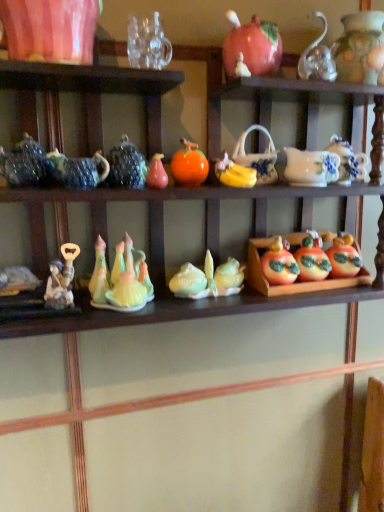
In order to click on matte ceramic apples at center right in this screenshot , I will do `click(316, 264)`.

How much space does transparent glass mug at upper center, which ranks as the 3th tableware in left-to-right order, occupy horizontally?

transparent glass mug at upper center, which ranks as the 3th tableware in left-to-right order, is 6.12 inches in width.

This screenshot has width=384, height=512. What do you see at coordinates (208, 279) in the screenshot?
I see `matte ceramic corn at center, the 2th toy from the back` at bounding box center [208, 279].

Image resolution: width=384 pixels, height=512 pixels. What do you see at coordinates (317, 58) in the screenshot?
I see `transparent glass teapot at upper right, the fifth tableware from the left` at bounding box center [317, 58].

Image resolution: width=384 pixels, height=512 pixels. Describe the element at coordinates (344, 257) in the screenshot. I see `matte ceramic pumpkin at center right, the second pumpkin when ordered from top to bottom` at that location.

Where is `yellow matte banana at center, the first fruit positioned from the front`? yellow matte banana at center, the first fruit positioned from the front is located at coordinates (234, 173).

From a real-world perspective, is matte pink vase at upper left, the 1th tableware when ordered from left to right, physically located above or below matte ceramic apples at center, arranged as the 2th toy when viewed from the top?

matte pink vase at upper left, the 1th tableware when ordered from left to right, is situated higher than matte ceramic apples at center, arranged as the 2th toy when viewed from the top, in the real world.

Between matte pink vase at upper left, which is the fifth tableware in right-to-left order, and matte ceramic apples at center, placed as the 3th toy when sorted from left to right, which one has less height?

Standing shorter between the two is matte ceramic apples at center, placed as the 3th toy when sorted from left to right.

What's the angular difference between matte pink vase at upper left, the 1th tableware when ordered from left to right, and matte ceramic apples at center, arranged as the 2th toy when viewed from the top,'s facing directions?

There is a 3.78-degree angle between the facing directions of matte pink vase at upper left, the 1th tableware when ordered from left to right, and matte ceramic apples at center, arranged as the 2th toy when viewed from the top.

Is matte pink vase at upper left, the 1th tableware when ordered from left to right, bigger than matte ceramic apples at center, the first toy when ordered from right to left?

Yes, matte pink vase at upper left, the 1th tableware when ordered from left to right, is bigger than matte ceramic apples at center, the first toy when ordered from right to left.

Locate an element on the screen. food on the right side of matte ceramic pumpkin at upper center, marked as the 2th pumpkin in a right-to-left arrangement is located at coordinates (316, 264).

Is matte ceramic pumpkin at upper center, the first pumpkin in the left-to-right sequence, oriented away from matte ceramic apples at center right?

No, matte ceramic apples at center right is not at the back of matte ceramic pumpkin at upper center, the first pumpkin in the left-to-right sequence.

Which object is further away from the camera taking this photo, matte ceramic pumpkin at upper center, placed as the second pumpkin when sorted from bottom to top, or matte ceramic apples at center right?

matte ceramic apples at center right is more distant.

From the image's perspective, does matte ceramic pumpkin at upper center, which ranks as the 1th pumpkin in top-to-bottom order, appear lower than matte ceramic apples at center right?

No, from the image's perspective, matte ceramic pumpkin at upper center, which ranks as the 1th pumpkin in top-to-bottom order, is not beneath matte ceramic apples at center right.

Is matte ceramic corn at center, positioned as the second toy in front-to-back order, in contact with yellow matte banana at center, positioned as the 1th fruit in left-to-right order?

No, matte ceramic corn at center, positioned as the second toy in front-to-back order, is not making contact with yellow matte banana at center, positioned as the 1th fruit in left-to-right order.

Which is in front, point (198, 282) or point (240, 174)?

The point (240, 174) is closer.

From a real-world perspective, which is physically below, matte ceramic corn at center, positioned as the second toy in right-to-left order, or yellow matte banana at center, placed as the 2th fruit when sorted from right to left?

From a 3D spatial view, matte ceramic corn at center, positioned as the second toy in right-to-left order, is below.

Is matte ceramic apples at center right shorter than matte ceramic corn at center, which ranks as the 1th toy in bottom-to-top order?

No, matte ceramic apples at center right is not shorter than matte ceramic corn at center, which ranks as the 1th toy in bottom-to-top order.

Is matte ceramic apples at center right oriented towards matte ceramic corn at center, which is the 2th toy in left-to-right order?

No, matte ceramic apples at center right is not aimed at matte ceramic corn at center, which is the 2th toy in left-to-right order.

Is matte ceramic apples at center right next to matte ceramic corn at center, positioned as the second toy in right-to-left order, and touching it?

No, matte ceramic apples at center right is not beside matte ceramic corn at center, positioned as the second toy in right-to-left order.

From a real-world perspective, is matte ceramic apples at center right physically located above or below matte ceramic corn at center, positioned as the second toy in front-to-back order?

matte ceramic apples at center right is above matte ceramic corn at center, positioned as the second toy in front-to-back order.

Consider the image. Is yellow matte banana at center, which is the 2th fruit in back-to-front order, wider or thinner than transparent glass teapot at upper right, the fifth tableware from the left?

Considering their sizes, yellow matte banana at center, which is the 2th fruit in back-to-front order, looks slimmer than transparent glass teapot at upper right, the fifth tableware from the left.

Between yellow matte banana at center, the first fruit positioned from the front, and transparent glass teapot at upper right, acting as the first tableware starting from the right, which one has smaller size?

yellow matte banana at center, the first fruit positioned from the front.

Considering the relative positions of yellow matte banana at center, placed as the 2th fruit when sorted from right to left, and transparent glass teapot at upper right, acting as the first tableware starting from the right, in the image provided, is yellow matte banana at center, placed as the 2th fruit when sorted from right to left, to the right of transparent glass teapot at upper right, acting as the first tableware starting from the right, from the viewer's perspective?

Incorrect, yellow matte banana at center, placed as the 2th fruit when sorted from right to left, is not on the right side of transparent glass teapot at upper right, acting as the first tableware starting from the right.

How much distance is there between yellow matte banana at center, acting as the 2th fruit starting from the bottom, and transparent glass teapot at upper right, the fifth tableware from the left?

The distance of yellow matte banana at center, acting as the 2th fruit starting from the bottom, from transparent glass teapot at upper right, the fifth tableware from the left, is 10.33 inches.

From the image's perspective, which is above, white porcelain vase at center, which appears as the 4th tableware when viewed from the left, or transparent glass teapot at upper right, the fifth tableware from the left?

transparent glass teapot at upper right, the fifth tableware from the left, appears higher in the image.

From the picture: In the image, is white porcelain vase at center, which ranks as the 2th tableware in right-to-left order, positioned in front of or behind transparent glass teapot at upper right, the fifth tableware from the left?

Visually, white porcelain vase at center, which ranks as the 2th tableware in right-to-left order, is located behind transparent glass teapot at upper right, the fifth tableware from the left.

Is the surface of white porcelain vase at center, which appears as the 4th tableware when viewed from the left, in direct contact with transparent glass teapot at upper right, the fifth tableware from the left?

No, white porcelain vase at center, which appears as the 4th tableware when viewed from the left, is not beside transparent glass teapot at upper right, the fifth tableware from the left.

Which is more to the right, white porcelain vase at center, which ranks as the 2th tableware in right-to-left order, or transparent glass teapot at upper right, the fifth tableware from the left?

Positioned to the right is transparent glass teapot at upper right, the fifth tableware from the left.

Is black glossy teapot at upper center, arranged as the second tableware when viewed from the left, not close to matte ceramic apples at center right?

Actually, black glossy teapot at upper center, arranged as the second tableware when viewed from the left, and matte ceramic apples at center right are a little close together.

From the image's perspective, which is below, black glossy teapot at upper center, arranged as the second tableware when viewed from the left, or matte ceramic apples at center right?

matte ceramic apples at center right, from the image's perspective.

At what (x,y) coordinates should I click in order to perform the action: click on the 5th tableware in front of the matte ceramic apples at center, the 1th toy positioned from the back, starting your count from the anchor. Please return your answer as a coordinate pair (x, y). Looking at the image, I should click on (50, 29).

I want to click on food below the matte ceramic pumpkin at upper center, placed as the second pumpkin when sorted from bottom to top (from the image's perspective), so click(316, 264).

Estimate the real-world distances between objects in this image. Which object is closer to transparent glass mug at upper center, which ranks as the 3th tableware in left-to-right order, matte ceramic corn at center, the 2th toy from the back, or matte ceramic apples at center right?

matte ceramic corn at center, the 2th toy from the back, is positioned closer to the anchor transparent glass mug at upper center, which ranks as the 3th tableware in left-to-right order.

Estimate the real-world distances between objects in this image. Which object is closer to pear-shaped ceramic at center, the 1th toy when ordered from top to bottom, yellow matte banana at center, acting as the 2th fruit starting from the bottom, or matte ceramic pumpkin at center right, which is counted as the first pumpkin, starting from the right?

yellow matte banana at center, acting as the 2th fruit starting from the bottom, is positioned closer to the anchor pear-shaped ceramic at center, the 1th toy when ordered from top to bottom.

From the image, which object appears to be nearer to matte ceramic pumpkin at center right, which is the first pumpkin in back-to-front order, pear-shaped ceramic at center, the 1th toy when ordered from top to bottom, or matte ceramic pumpkin at upper center, the first pumpkin in the left-to-right sequence?

matte ceramic pumpkin at upper center, the first pumpkin in the left-to-right sequence, is closer to matte ceramic pumpkin at center right, which is the first pumpkin in back-to-front order.

Which object lies nearer to the anchor point yellow matte banana at center, the first fruit positioned from the front, matte ceramic apples at center, the 3th toy viewed from the front, or transparent glass mug at upper center, the 3th tableware viewed from the right?

matte ceramic apples at center, the 3th toy viewed from the front.

In the scene shown: From the image, which object appears to be farther from transparent glass mug at upper center, the 3th tableware viewed from the right, matte ceramic corn at center, the 2th toy from the back, or white porcelain vase at center, which appears as the 4th tableware when viewed from the left?

The object further to transparent glass mug at upper center, the 3th tableware viewed from the right, is matte ceramic corn at center, the 2th toy from the back.

Considering their positions, is shiny ceramic apple at center right, marked as the first fruit in a back-to-front arrangement, positioned closer to matte ceramic apples at center right than matte ceramic pumpkin at center right, which is the first pumpkin in back-to-front order?

Based on the image, matte ceramic pumpkin at center right, which is the first pumpkin in back-to-front order, appears to be nearer to matte ceramic apples at center right.

When comparing their distances from shiny ceramic apple at center right, the 1th fruit when ordered from bottom to top, does white porcelain vase at center, which ranks as the 2th tableware in right-to-left order, or matte ceramic apples at center, the first toy when ordered from right to left, seem further?

white porcelain vase at center, which ranks as the 2th tableware in right-to-left order, is further to shiny ceramic apple at center right, the 1th fruit when ordered from bottom to top.

Considering their positions, is matte ceramic pumpkin at center right, which is the first pumpkin in back-to-front order, positioned further to matte ceramic apples at center right than shiny ceramic apple at center right, which is the 2th fruit from left to right?

Among the two, shiny ceramic apple at center right, which is the 2th fruit from left to right, is located further to matte ceramic apples at center right.

Find the location of `fruit between matte ceramic pumpkin at upper center, arranged as the second pumpkin when viewed from the back, and pear-shaped ceramic at center, positioned as the first toy in left-to-right order, in the up-down direction`. fruit between matte ceramic pumpkin at upper center, arranged as the second pumpkin when viewed from the back, and pear-shaped ceramic at center, positioned as the first toy in left-to-right order, in the up-down direction is located at coordinates (234, 173).

What are the coordinates of `food between matte pink vase at upper left, the 1th tableware when ordered from left to right, and matte ceramic pumpkin at center right, which is the first pumpkin in back-to-front order, in the horizontal direction` in the screenshot? It's located at (316, 264).

Find the location of `pumpkin between transparent glass mug at upper center, which ranks as the 3th tableware in left-to-right order, and white porcelain vase at center, which ranks as the 2th tableware in right-to-left order, in the horizontal direction`. pumpkin between transparent glass mug at upper center, which ranks as the 3th tableware in left-to-right order, and white porcelain vase at center, which ranks as the 2th tableware in right-to-left order, in the horizontal direction is located at coordinates pos(251,48).

Where is `fruit situated between matte pink vase at upper left, which is the fifth tableware in right-to-left order, and shiny ceramic apple at center right, which is the 2th fruit from left to right, from left to right`? The width and height of the screenshot is (384, 512). fruit situated between matte pink vase at upper left, which is the fifth tableware in right-to-left order, and shiny ceramic apple at center right, which is the 2th fruit from left to right, from left to right is located at coordinates (234, 173).